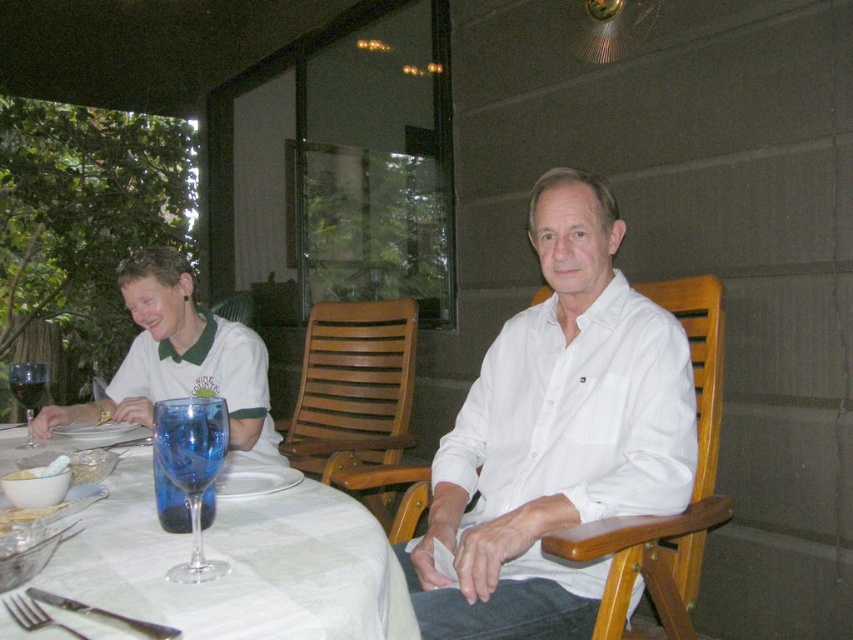
You are a server at a restaurant and need to place a 9 inch long dessert menu between the blue glass at table left and the white creamy rice at table left. Can you fit it there?

The blue glass at table left and white creamy rice at table left are 8.61 inches apart from each other, so the dessert menu is 0.39 inches too long to fit between them.

You are a photographer standing at the camera position. You want to adjust your position so that you can see both the light brown wooden chair at center and the person sitting on it clearly in your shot. Considering the distance between the camera and the chair, is it feasible to capture both the chair and the person in the same frame without moving the camera?

The light brown wooden chair at center and the camera are 1.68 meters apart. Since the person is sitting on the chair, they are at the same distance from the camera as the chair itself. Therefore, it is feasible to capture both the chair and the person in the same frame without moving the camera, as they are at the same distance from the camera position.

You are a waiter carrying a tray of dishes. You need to walk from the kitchen entrance to deliver the dishes to the table where the light brown wooden chair at center and white creamy rice at table left are located. The shortest path requires passing through a narrow corridor that is 1.4 meters wide. Will you be able to navigate through the corridor to reach the table?

The light brown wooden chair at center is 1.50 meters away from the white creamy rice at table left. Since the corridor is only 1.4 meters wide, the distance between the two objects is wider than the corridor, so the waiter might not be able to navigate through the corridor to reach the table safely.